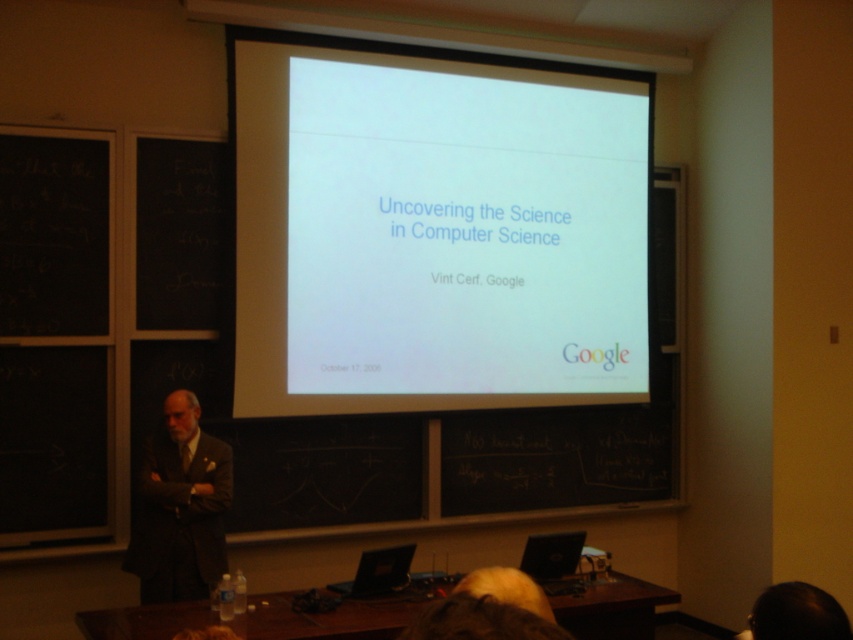
You are sitting in the classroom and want to see both the brown woolen suit at left and the blonde hair at lower center. Which one will appear closer to you?

The brown woolen suit at left is closer to you because it is further to the viewer than the blonde hair at lower center.

You are an attendee at the presentation and want to take a photo of the slide displayed on the white matte projector screen at upper center. However, you notice the brown woolen suit at left might be blocking your view. Based on their positions, can you still see the slide clearly?

The white matte projector screen at upper center is positioned over the brown woolen suit at left, so the screen is above the suit. This means the suit is below the screen, so you should still be able to see the slide clearly as long as the suit isn